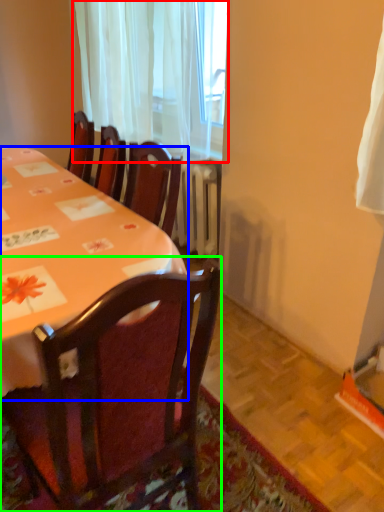
Question: Which is nearer to the curtain (highlighted by a red box)? desk (highlighted by a blue box) or chair (highlighted by a green box).

Choices:
 (A) desk
 (B) chair

Answer: (A)